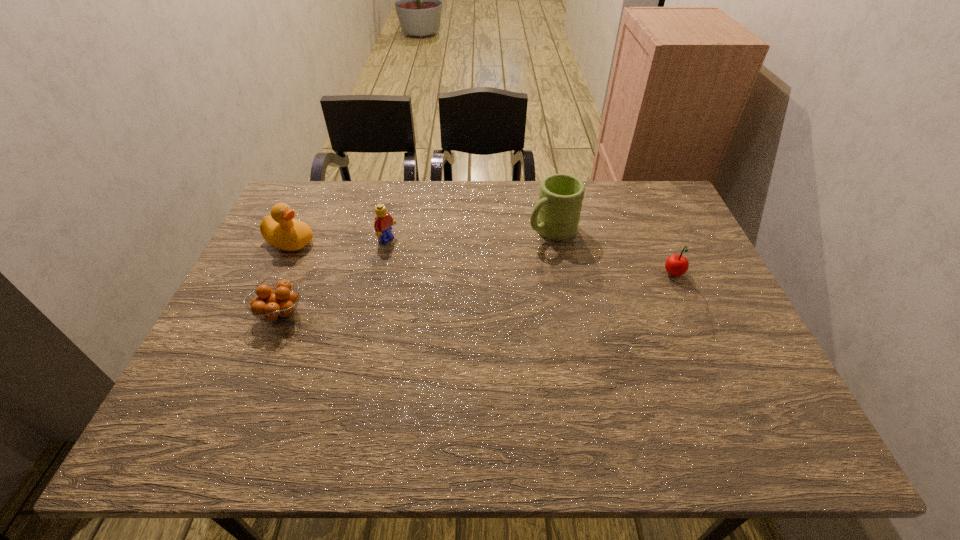
This screenshot has width=960, height=540. In order to click on the nearest object in this screenshot , I will do `click(280, 304)`.

This screenshot has width=960, height=540. In order to click on orange fruit in this screenshot , I will do `click(280, 304)`.

Locate an element on the screen. the second nearest object is located at coordinates (676, 265).

Identify the location of the rightmost object. (676, 265).

Where is `the third object from right to left`? Image resolution: width=960 pixels, height=540 pixels. the third object from right to left is located at coordinates (383, 223).

Where is `duck`? duck is located at coordinates (280, 229).

The height and width of the screenshot is (540, 960). I want to click on the fourth object from left to right, so click(556, 215).

Where is `free space located 0.250m on the right of the orange fruit`? The width and height of the screenshot is (960, 540). free space located 0.250m on the right of the orange fruit is located at coordinates (406, 314).

The image size is (960, 540). I want to click on vacant position located 0.190m on the back of the rightmost object, so click(651, 224).

The image size is (960, 540). Find the location of `vacant space located on the front-facing side of the Lego`. vacant space located on the front-facing side of the Lego is located at coordinates (410, 253).